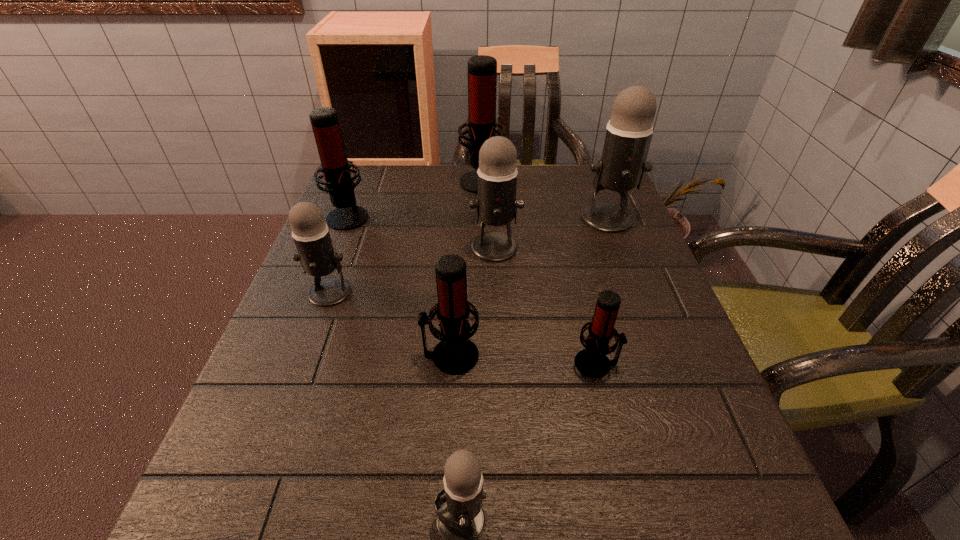
Identify the location of gray microphone object that ranks as the third closest to the leftmost red microphone. (622, 165).

At what (x,y) coordinates should I click in order to perform the action: click on free location that satisfies the following two spatial constraints: 1. on the back side of the fourth nearest microphone; 2. on the right side of the rightmost object. Please return your answer as a coordinate pair (x, y). The height and width of the screenshot is (540, 960). Looking at the image, I should click on (357, 218).

In order to click on blank space that satisfies the following two spatial constraints: 1. on the front side of the farthest microphone; 2. on the right side of the rightmost gray microphone in this screenshot , I will do `click(482, 218)`.

This screenshot has width=960, height=540. Identify the location of blank area in the image that satisfies the following two spatial constraints: 1. on the front side of the third farthest gray microphone; 2. on the left side of the third biggest red microphone. (307, 356).